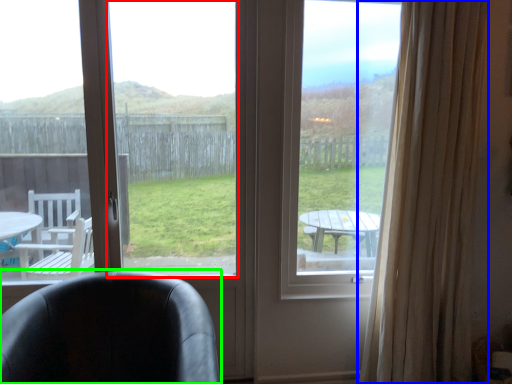
Question: Which object is positioned closest to window screen (highlighted by a red box)? Select from curtain (highlighted by a blue box) and chair (highlighted by a green box).

Choices:
 (A) curtain
 (B) chair

Answer: (B)